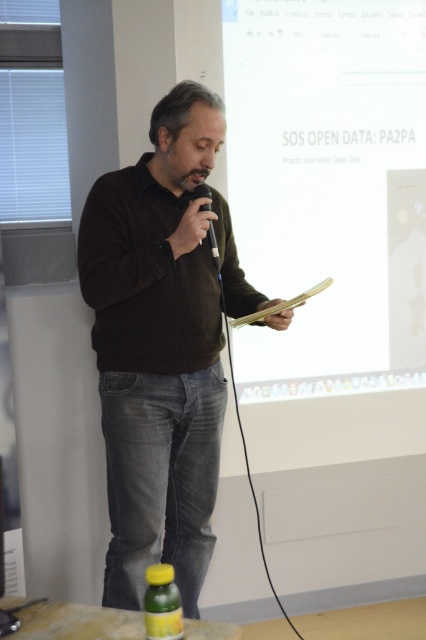
In the scene shown: You are organizing a small event and need to place a decorative item on the table. The green matte bottle at lower center is currently there. Can you replace it with the white matte projection screen at upper center without moving the table?

The white matte projection screen at upper center is much larger in size than the green matte bottle at lower center. Therefore, replacing the green matte bottle with the white matte projection screen would not be feasible due to the significant size difference, making the screen too large for the space intended for the bottle.

Based on the photo, you are a participant in the lecture and you need to reach the green matte bottle at lower center located at point (161,604). The room has a clear path from your current position. What is the shortest distance you need to walk to reach it?

The green matte bottle at lower center is located at point (161,604). To reach it, you would need to walk the distance from your current position to that point, which is the shortest path available in the room.

You are sitting in the front row of the lecture hall and want to hand the speaker a note. The note is in your pocket, and you need to decide whether to reach for the brown matte sweater at center or the black plastic microphone at center first. Which object should you aim for to reach the speaker more quickly?

The brown matte sweater at center is closer to the viewer than the black plastic microphone at center, so you should aim for the brown matte sweater at center first to reach the speaker more quickly.